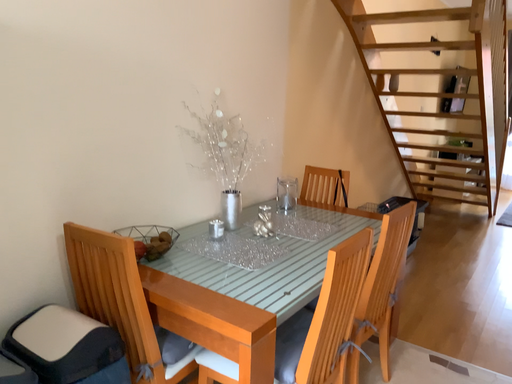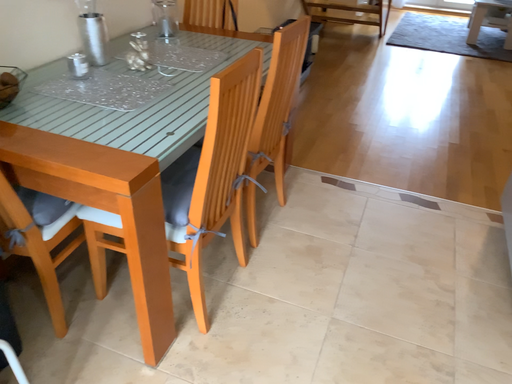
Question: How did the camera likely rotate when shooting the video?

Choices:
 (A) rotated right
 (B) rotated left

Answer: (A)